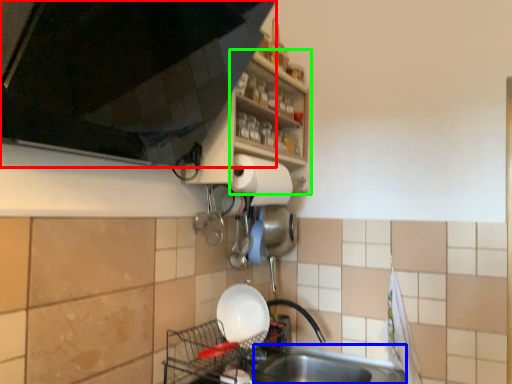
Question: Which object is positioned closest to cabinetry (highlighted by a red box)? Select from sink (highlighted by a blue box) and shelf (highlighted by a green box).

Choices:
 (A) sink
 (B) shelf

Answer: (B)